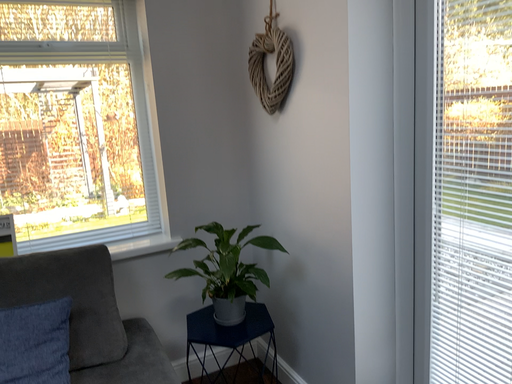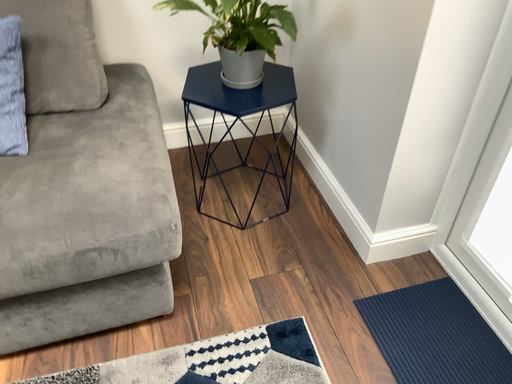
Question: Which way did the camera rotate in the video?

Choices:
 (A) rotated left
 (B) rotated right

Answer: (A)